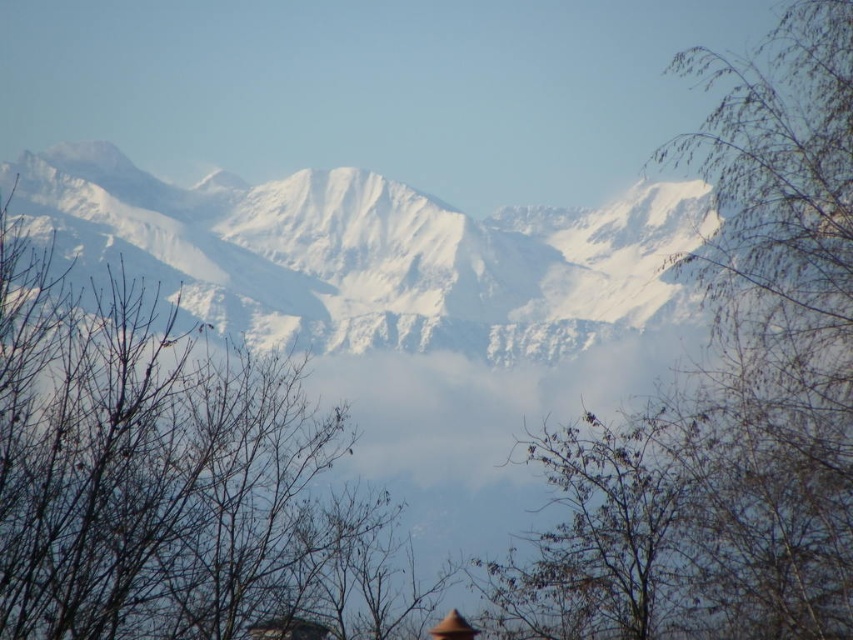
Between point (640, 422) and point (241, 483), which one is positioned behind?

The point (640, 422) is behind.

Who is lower down, bare branches at upper right or bare branches at center?

bare branches at center is lower down.

What do you see at coordinates (728, 394) in the screenshot? This screenshot has height=640, width=853. I see `bare branches at upper right` at bounding box center [728, 394].

The image size is (853, 640). Identify the location of bare branches at upper right. (728, 394).